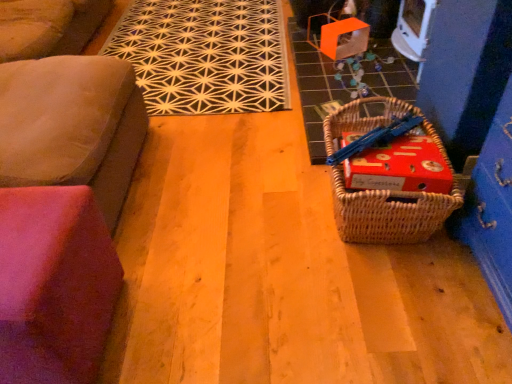
Measure the distance between red cardboard box at lower right and camera.

1.28 meters.

The width and height of the screenshot is (512, 384). Describe the element at coordinates (400, 166) in the screenshot. I see `red cardboard box at lower right` at that location.

Describe the element at coordinates (205, 55) in the screenshot. I see `black geometric rug at upper center` at that location.

Describe the element at coordinates (72, 126) in the screenshot. I see `suede couch at left, which appears as the second furniture when ordered from the bottom` at that location.

Where is `woven brown picnic basket at lower right`? This screenshot has height=384, width=512. woven brown picnic basket at lower right is located at coordinates (x=391, y=212).

Identify the location of red cardboard box at lower right. The height and width of the screenshot is (384, 512). (400, 166).

Is pink fabric cushion at lower left, which is the first furniture from bottom to top, at the back of woven brown picnic basket at lower right?

woven brown picnic basket at lower right does not have its back to pink fabric cushion at lower left, which is the first furniture from bottom to top.

Considering the points (338, 221) and (38, 213), which point is in front, point (338, 221) or point (38, 213)?

The point (38, 213) is closer to the camera.

Between woven brown picnic basket at lower right and pink fabric cushion at lower left, which is the first furniture from bottom to top, which one has less height?

With less height is woven brown picnic basket at lower right.

Is pink fabric cushion at lower left, which is the first furniture from bottom to top, completely or partially inside woven brown picnic basket at lower right?

No, pink fabric cushion at lower left, which is the first furniture from bottom to top, is not inside woven brown picnic basket at lower right.

Is suede couch at left, which appears as the second furniture when ordered from the bottom, inside or outside of red cardboard box at lower right?

The correct answer is: outside.

From the image's perspective, which is above, suede couch at left, which appears as the second furniture when ordered from the bottom, or red cardboard box at lower right?

suede couch at left, which appears as the second furniture when ordered from the bottom.

From the picture: Is suede couch at left, acting as the 1th furniture starting from the top, far from red cardboard box at lower right?

No, suede couch at left, acting as the 1th furniture starting from the top, is not far from red cardboard box at lower right.

Can you confirm if pink fabric cushion at lower left, the second furniture from the top, is bigger than woven brown picnic basket at lower right?

Indeed, pink fabric cushion at lower left, the second furniture from the top, has a larger size compared to woven brown picnic basket at lower right.

This screenshot has width=512, height=384. In order to click on picnic basket that is behind the pink fabric cushion at lower left, the second furniture from the top in this screenshot , I will do `click(391, 212)`.

Considering the sizes of objects pink fabric cushion at lower left, which is the first furniture from bottom to top, and woven brown picnic basket at lower right in the image provided, who is taller, pink fabric cushion at lower left, which is the first furniture from bottom to top, or woven brown picnic basket at lower right?

Standing taller between the two is pink fabric cushion at lower left, which is the first furniture from bottom to top.

Is pink fabric cushion at lower left, which is the first furniture from bottom to top, not inside woven brown picnic basket at lower right?

Absolutely, pink fabric cushion at lower left, which is the first furniture from bottom to top, is external to woven brown picnic basket at lower right.

Which is in front, point (126, 129) or point (369, 124)?

The point (369, 124) is in front.

Is suede couch at left, which appears as the second furniture when ordered from the bottom, aimed at woven brown picnic basket at lower right?

Yes, suede couch at left, which appears as the second furniture when ordered from the bottom, is turned towards woven brown picnic basket at lower right.

Based on the photo, does suede couch at left, which appears as the second furniture when ordered from the bottom, come in front of woven brown picnic basket at lower right?

Yes, suede couch at left, which appears as the second furniture when ordered from the bottom, is closer to the camera.

From the image's perspective, would you say suede couch at left, which appears as the second furniture when ordered from the bottom, is positioned over woven brown picnic basket at lower right?

Indeed, from the image's perspective, suede couch at left, which appears as the second furniture when ordered from the bottom, is shown above woven brown picnic basket at lower right.

Consider the image. Does pink fabric cushion at lower left, which is the first furniture from bottom to top, have a smaller size compared to black geometric rug at upper center?

Indeed, pink fabric cushion at lower left, which is the first furniture from bottom to top, has a smaller size compared to black geometric rug at upper center.

Can we say pink fabric cushion at lower left, the second furniture from the top, lies outside black geometric rug at upper center?

Yes, pink fabric cushion at lower left, the second furniture from the top, is outside of black geometric rug at upper center.

Can you confirm if pink fabric cushion at lower left, the second furniture from the top, is shorter than black geometric rug at upper center?

No, pink fabric cushion at lower left, the second furniture from the top, is not shorter than black geometric rug at upper center.

Can you tell me how much pink fabric cushion at lower left, which is the first furniture from bottom to top, and black geometric rug at upper center differ in facing direction?

The angular difference between pink fabric cushion at lower left, which is the first furniture from bottom to top, and black geometric rug at upper center is 1.4 degrees.

How much distance is there between red cardboard box at lower right and pink fabric cushion at lower left, which is the first furniture from bottom to top?

red cardboard box at lower right is 35.29 inches from pink fabric cushion at lower left, which is the first furniture from bottom to top.

Is red cardboard box at lower right outside of pink fabric cushion at lower left, the second furniture from the top?

Indeed, red cardboard box at lower right is completely outside pink fabric cushion at lower left, the second furniture from the top.

From a real-world perspective, is red cardboard box at lower right physically above pink fabric cushion at lower left, the second furniture from the top?

Yes, from a real-world perspective, red cardboard box at lower right is over pink fabric cushion at lower left, the second furniture from the top

Is red cardboard box at lower right shorter than pink fabric cushion at lower left, the second furniture from the top?

Correct, red cardboard box at lower right is not as tall as pink fabric cushion at lower left, the second furniture from the top.

Looking at this image, who is bigger, black geometric rug at upper center or pink fabric cushion at lower left, the second furniture from the top?

black geometric rug at upper center.

Is black geometric rug at upper center touching pink fabric cushion at lower left, the second furniture from the top?

No, black geometric rug at upper center is not beside pink fabric cushion at lower left, the second furniture from the top.

From the image's perspective, is black geometric rug at upper center above or below pink fabric cushion at lower left, the second furniture from the top?

black geometric rug at upper center is situated higher than pink fabric cushion at lower left, the second furniture from the top, in the image.

In order to click on furniture below the woven brown picnic basket at lower right (from the image's perspective) in this screenshot , I will do `click(54, 285)`.

Where is `cardboard box behind the suede couch at left, which appears as the second furniture when ordered from the bottom`? This screenshot has height=384, width=512. cardboard box behind the suede couch at left, which appears as the second furniture when ordered from the bottom is located at coordinates (400, 166).

Looking at the image, which one is located closer to pink fabric cushion at lower left, which is the first furniture from bottom to top, black geometric rug at upper center or suede couch at left, acting as the 1th furniture starting from the top?

suede couch at left, acting as the 1th furniture starting from the top, lies closer to pink fabric cushion at lower left, which is the first furniture from bottom to top, than the other object.

When comparing their distances from pink fabric cushion at lower left, which is the first furniture from bottom to top, does woven brown picnic basket at lower right or black geometric rug at upper center seem further?

black geometric rug at upper center is positioned further to the anchor pink fabric cushion at lower left, which is the first furniture from bottom to top.

Based on their spatial positions, is woven brown picnic basket at lower right or pink fabric cushion at lower left, which is the first furniture from bottom to top, closer to suede couch at left, acting as the 1th furniture starting from the top?

pink fabric cushion at lower left, which is the first furniture from bottom to top, lies closer to suede couch at left, acting as the 1th furniture starting from the top, than the other object.

Estimate the real-world distances between objects in this image. Which object is further from red cardboard box at lower right, woven brown picnic basket at lower right or black geometric rug at upper center?

The object further to red cardboard box at lower right is black geometric rug at upper center.

When comparing their distances from black geometric rug at upper center, does red cardboard box at lower right or woven brown picnic basket at lower right seem closer?

red cardboard box at lower right lies closer to black geometric rug at upper center than the other object.

In the scene shown: From the image, which object appears to be farther from black geometric rug at upper center, woven brown picnic basket at lower right or red cardboard box at lower right?

Among the two, woven brown picnic basket at lower right is located further to black geometric rug at upper center.

From the image, which object appears to be farther from black geometric rug at upper center, suede couch at left, acting as the 1th furniture starting from the top, or red cardboard box at lower right?

The object further to black geometric rug at upper center is red cardboard box at lower right.

When comparing their distances from pink fabric cushion at lower left, which is the first furniture from bottom to top, does red cardboard box at lower right or woven brown picnic basket at lower right seem closer?

The object closer to pink fabric cushion at lower left, which is the first furniture from bottom to top, is woven brown picnic basket at lower right.

Where is `cardboard box located between suede couch at left, which appears as the second furniture when ordered from the bottom, and woven brown picnic basket at lower right in the left-right direction`? This screenshot has height=384, width=512. cardboard box located between suede couch at left, which appears as the second furniture when ordered from the bottom, and woven brown picnic basket at lower right in the left-right direction is located at coordinates (400, 166).

Where is `mat between suede couch at left, which appears as the second furniture when ordered from the bottom, and red cardboard box at lower right from left to right`? The width and height of the screenshot is (512, 384). mat between suede couch at left, which appears as the second furniture when ordered from the bottom, and red cardboard box at lower right from left to right is located at coordinates (205, 55).

The width and height of the screenshot is (512, 384). Identify the location of furniture located between suede couch at left, which appears as the second furniture when ordered from the bottom, and red cardboard box at lower right in the left-right direction. (54, 285).

I want to click on furniture between suede couch at left, which appears as the second furniture when ordered from the bottom, and black geometric rug at upper center from front to back, so click(54, 285).